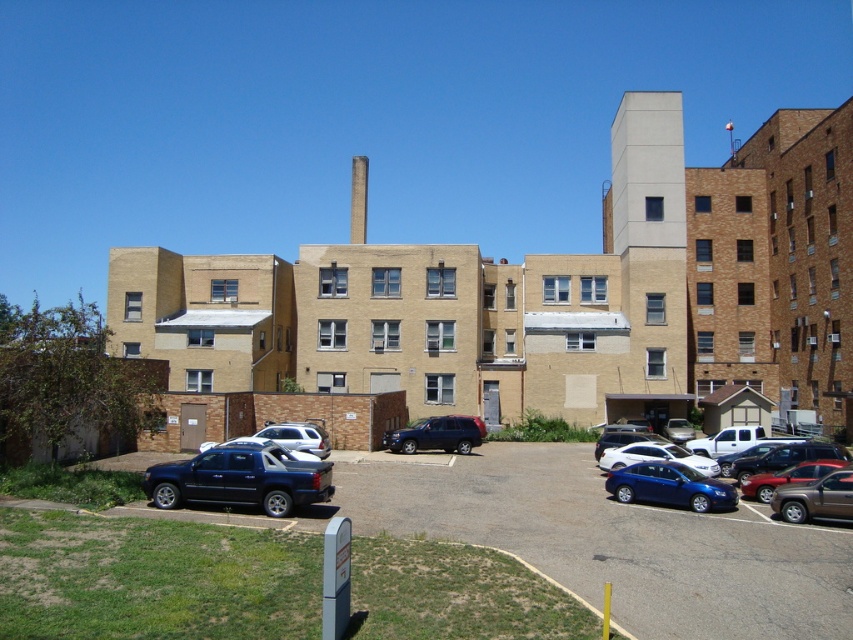
You are standing at the edge of the parking lot near the residential building complex. You want to walk to a specific point marked at coordinates point (653,625). Given that your walking path is straight and unobstructed, how far will you have to walk in feet?

The distance of point (653,625) from camera is 39.72 feet, so you will have to walk 39.72 feet.

You are a delivery driver needing to park your truck which is 12 meters long. You see the shiny silver suv at lower right and the white matte suv at center in the parking lot. Is there enough space between them to park your truck?

The distance between the shiny silver suv at lower right and the white matte suv at center is 16.22 meters. Since your truck is 12 meters long, there is sufficient space to park between them.

You are a delivery person trying to park your 2.0 meters tall delivery van. You see the matte blue sedan at center and the shiny silver suv at lower right in the parking lot. Which vehicle is shorter and can you park your van between them without hitting the roof?

The matte blue sedan at center is shorter than the shiny silver suv at lower right. Since your van is 2.0 meters tall, you need to check if the space between them allows enough vertical clearance. However, the description only mentions their relative heights, not the available space between them. You might need to assess the distance between the two vehicles to ensure there is sufficient room for your van.